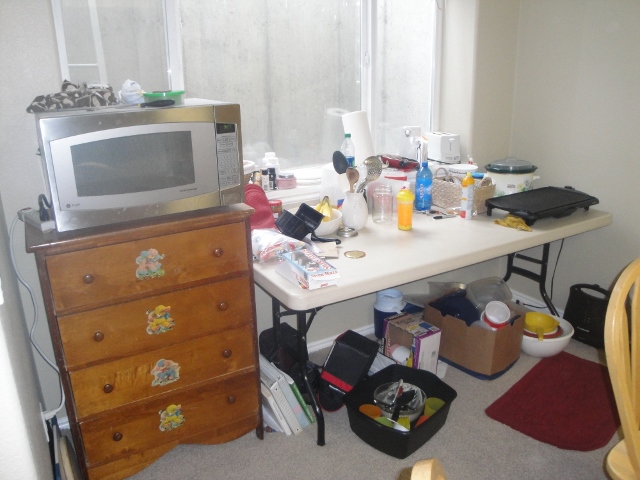
Where is `drawer`? drawer is located at coordinates (191, 266), (196, 346).